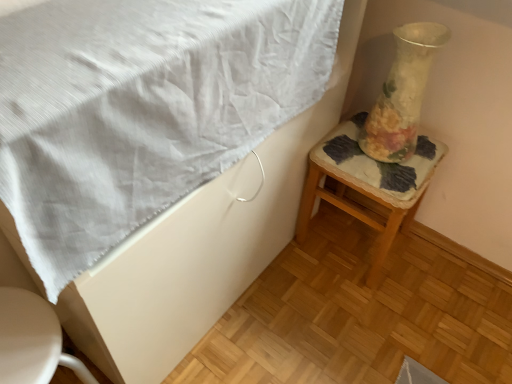
Locate an element on the screen. The height and width of the screenshot is (384, 512). vacant space underneath wooden stool with floral cushion at right (from a real-world perspective) is located at coordinates point(344,247).